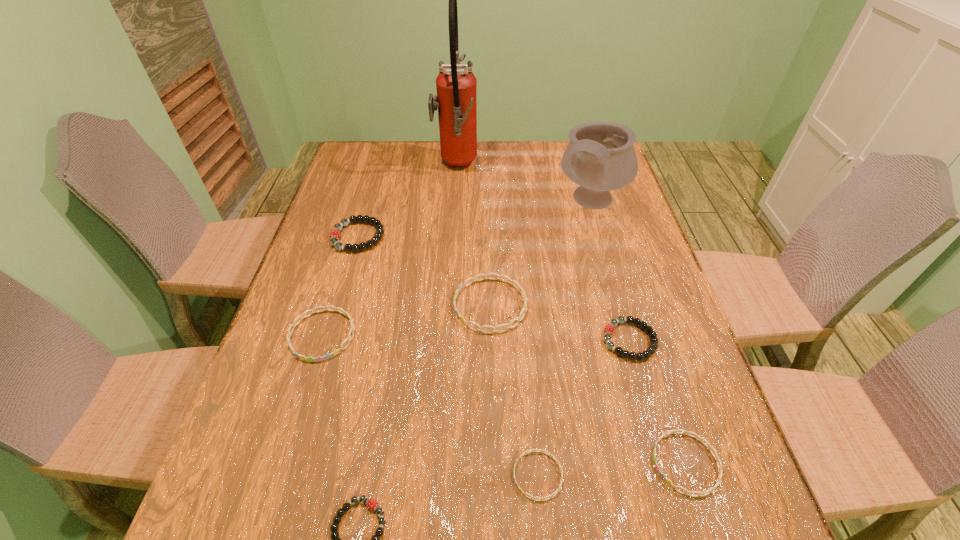
Locate an element on the screen. This screenshot has height=540, width=960. vacant space at the far edge of the desktop is located at coordinates (413, 143).

In the image, there is a desktop. Where is `vacant space at the left edge`? The image size is (960, 540). vacant space at the left edge is located at coordinates (348, 213).

This screenshot has height=540, width=960. I want to click on vacant space at the right edge, so click(659, 417).

I want to click on vacant space at the far left corner of the desktop, so click(x=384, y=160).

Locate an element on the screen. The height and width of the screenshot is (540, 960). free space between the shortest bracelet and the rightmost black bracelet is located at coordinates (584, 408).

Find the location of a particular element. The height and width of the screenshot is (540, 960). free spot between the shortest object and the tallest object is located at coordinates (497, 321).

The width and height of the screenshot is (960, 540). I want to click on blank region between the leftmost blue bracelet and the biggest blue bracelet, so click(x=406, y=320).

This screenshot has height=540, width=960. Identify the location of unoccupied position between the farthest black bracelet and the smallest blue bracelet. (448, 356).

Identify the location of vacant space in between the second nearest black bracelet and the farthest bracelet. (493, 288).

At what (x,y) coordinates should I click in order to perform the action: click on free space between the second biggest blue bracelet and the rightmost black bracelet. Please return your answer as a coordinate pair (x, y). Looking at the image, I should click on (475, 338).